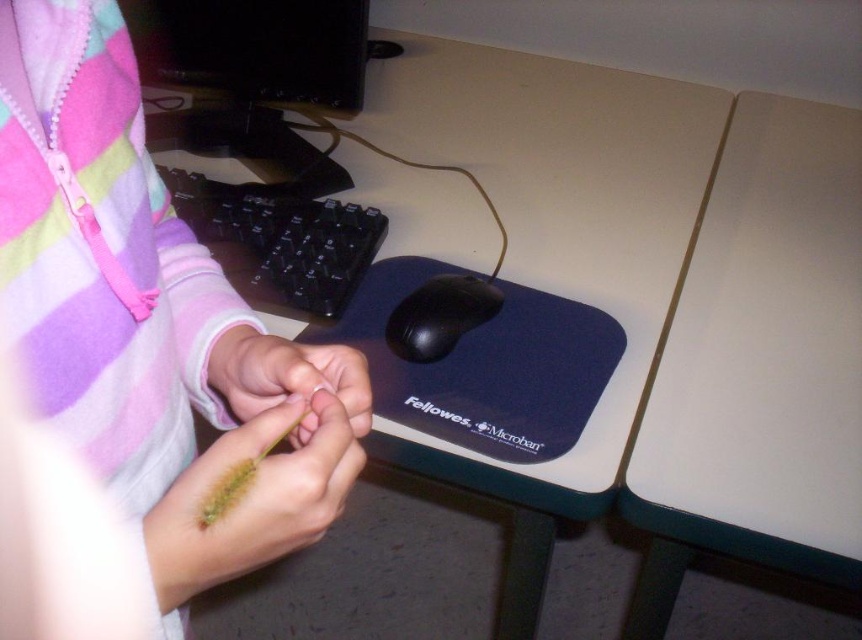
You are trying to reach for the green matte string at center while your hand is currently holding the black rubber mouse at center. Can you move your hand downward to grab the string without moving the mouse?

The green matte string at center is below the black rubber mouse at center, so yes, you can move your hand downward to grab the string without moving the mouse.

You are organizing a small event and need to place two items on the desk. The first item is a vase that needs to be placed on the white plastic table at center, and the second item is a centerpiece that must go on the white matte table at upper right. Based on their positions, which table is closer to the left edge of the desk?

The white plastic table at center is closer to the left edge of the desk because it is positioned to the left of the white matte table at upper right.

You are a craftsperson working on a project that requires precise placement of materials. You need to place a small sticker exactly at the center of the workspace. The green matte string at center is already placed at coordinates point 0.592, 0.334. What coordinates should you use to place the sticker so that it is exactly at the center of the workspace?

The center of the workspace is at point (431, 320). Since the green matte string at center is placed at (286, 378), you should move it to (431, 320) to be exactly at the center of the workspace.